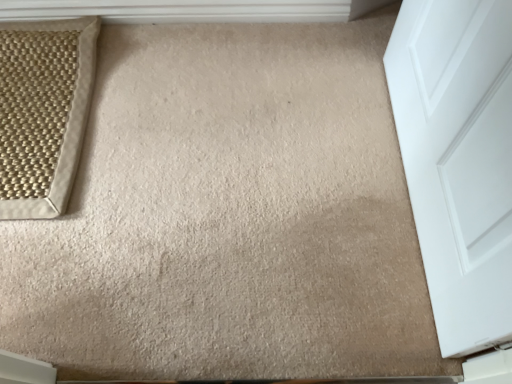
You are a GUI agent. You are given a task and a screenshot of the screen. Output one action in this format:
    pyautogui.click(x=<x>, y=<y>)
    Task: Click on the free location in front of beige woven rug at upper left
    
    Given the screenshot: What is the action you would take?
    pyautogui.click(x=93, y=266)